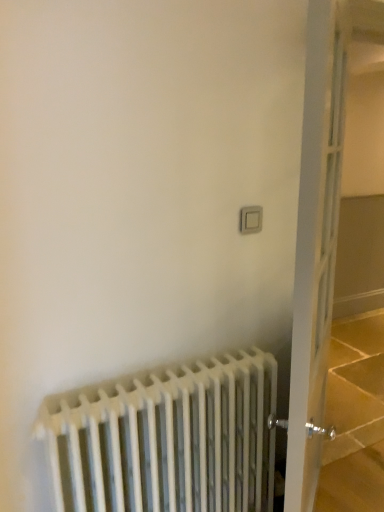
Question: Is white metal radiator at lower left inside or outside of white glass door at right?

Choices:
 (A) outside
 (B) inside

Answer: (A)

Question: Considering the positions of white metal radiator at lower left and white glass door at right in the image, is white metal radiator at lower left taller or shorter than white glass door at right?

Choices:
 (A) short
 (B) tall

Answer: (A)

Question: Which object is the farthest from the white glass door at right?

Choices:
 (A) white metal radiator at lower left
 (B) white plastic switch at upper right

Answer: (B)

Question: Based on their relative distances, which object is farther from the white metal radiator at lower left?

Choices:
 (A) white glass door at right
 (B) white plastic switch at upper right

Answer: (B)